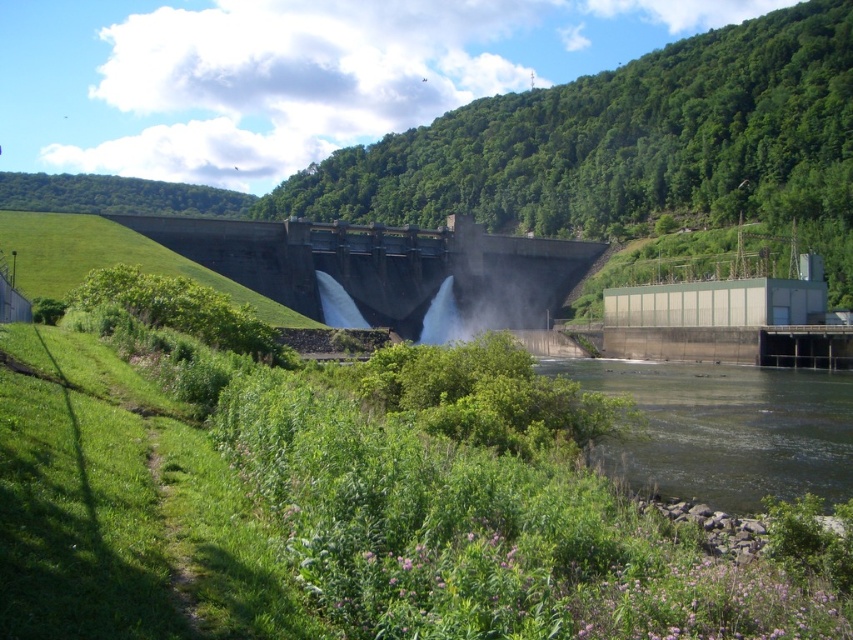
Question: Which point is farther from the camera taking this photo?

Choices:
 (A) (469, 266)
 (B) (799, 412)

Answer: (A)

Question: Which point is farther to the camera?

Choices:
 (A) (351, 292)
 (B) (683, 417)

Answer: (A)

Question: Can you confirm if greenish-gray concrete waterway at lower right is smaller than gray concrete dam at center?

Choices:
 (A) yes
 (B) no

Answer: (A)

Question: Is greenish-gray concrete waterway at lower right behind gray concrete dam at center?

Choices:
 (A) yes
 (B) no

Answer: (B)

Question: Observing the image, what is the correct spatial positioning of greenish-gray concrete waterway at lower right in reference to gray concrete dam at center?

Choices:
 (A) above
 (B) below

Answer: (B)

Question: Among these points, which one is nearest to the camera?

Choices:
 (A) (283, 225)
 (B) (757, 396)

Answer: (B)